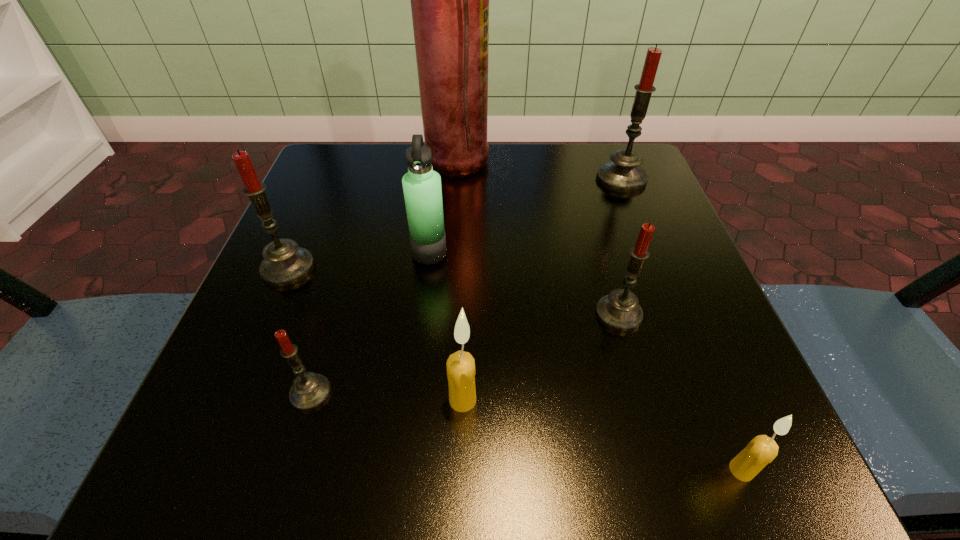
Locate an element on the screen. The image size is (960, 540). free spot that satisfies the following two spatial constraints: 1. on the side of the fire extinguisher with the label; 2. on the back side of the nearest candle is located at coordinates (428, 470).